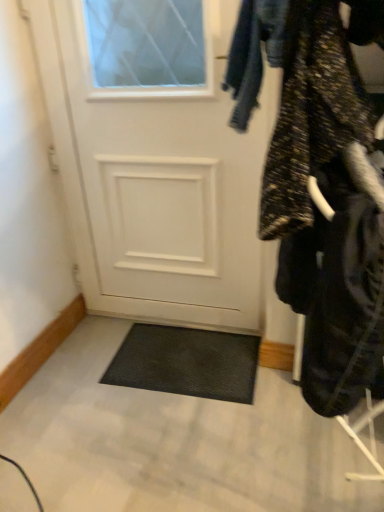
Question: From the image's perspective, is white matte door at center positioned above or below textured black coat at right?

Choices:
 (A) above
 (B) below

Answer: (A)

Question: Considering the positions of white matte door at center and textured black coat at right in the image, is white matte door at center wider or thinner than textured black coat at right?

Choices:
 (A) thin
 (B) wide

Answer: (A)

Question: In the image, is white matte door at center positioned in front of or behind textured black coat at right?

Choices:
 (A) behind
 (B) front

Answer: (A)

Question: In the image, is textured black coat at right on the left side or the right side of white matte door at center?

Choices:
 (A) right
 (B) left

Answer: (A)

Question: Is textured black coat at right spatially inside white matte door at center, or outside of it?

Choices:
 (A) inside
 (B) outside

Answer: (B)

Question: Is textured black coat at right in front of or behind white matte door at center in the image?

Choices:
 (A) behind
 (B) front

Answer: (B)

Question: Considering the positions of textured black coat at right and white matte door at center in the image, is textured black coat at right bigger or smaller than white matte door at center?

Choices:
 (A) big
 (B) small

Answer: (A)